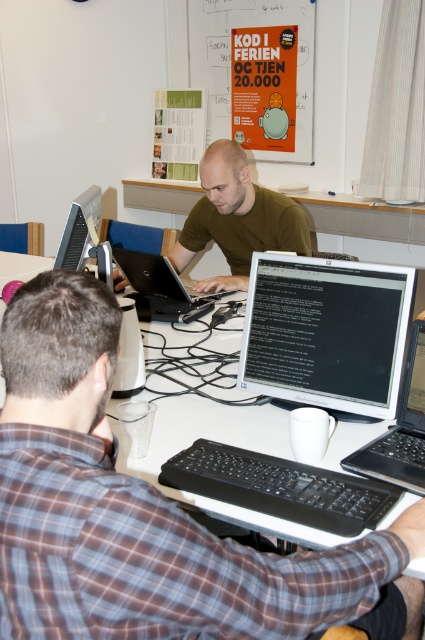
Question: Is the position of brown plaid shirt at center more distant than that of silver metallic computer at upper left?

Choices:
 (A) yes
 (B) no

Answer: (B)

Question: Is black glossy monitor at center below black glossy laptop at center?

Choices:
 (A) yes
 (B) no

Answer: (B)

Question: Based on their relative distances, which object is nearer to the black matte laptop at center?

Choices:
 (A) black glossy monitor at center
 (B) black glossy laptop at center
 (C) brown plaid shirt at center

Answer: (A)

Question: Which point is closer to the camera?

Choices:
 (A) black glossy monitor at center
 (B) green matte shirt at center

Answer: (A)

Question: Which object appears closest to the camera in this image?

Choices:
 (A) black glossy monitor at center
 (B) orange paper poster at upper center

Answer: (A)

Question: Can you confirm if brown plaid shirt at center is smaller than silver metallic computer at upper left?

Choices:
 (A) no
 (B) yes

Answer: (A)